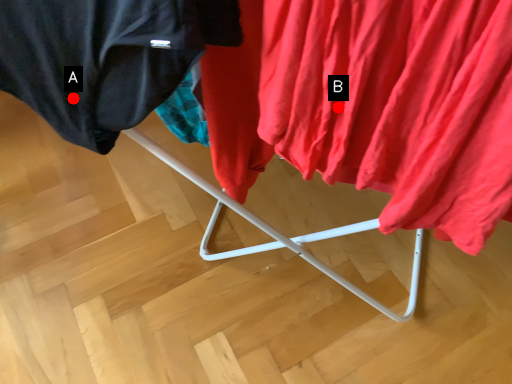
Question: Two points are circled on the image, labeled by A and B beside each circle. Which point appears closest to the camera in this image?

Choices:
 (A) A is closer
 (B) B is closer

Answer: (B)